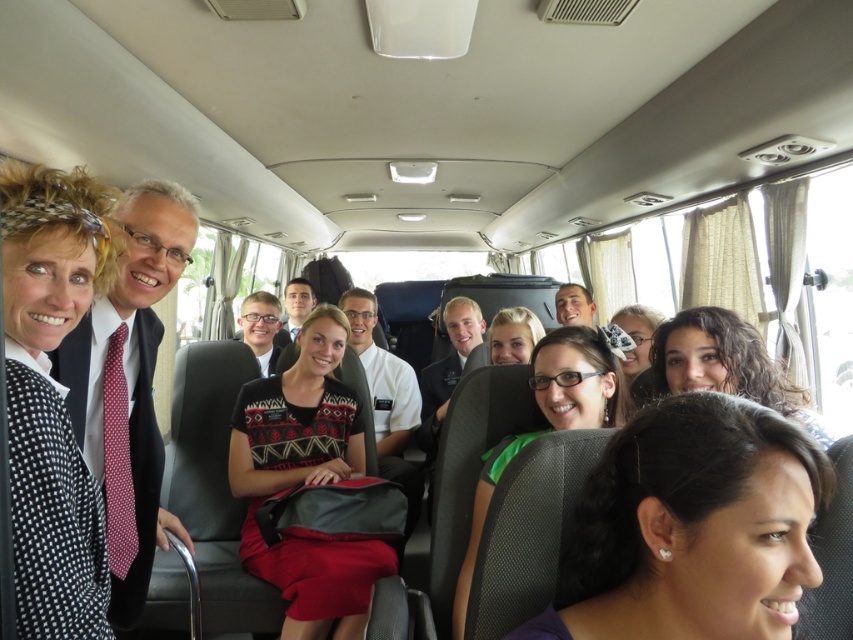
Can you confirm if knit sweater at center is positioned to the right of matte black suit at center?

Indeed, knit sweater at center is positioned on the right side of matte black suit at center.

Is point (294, 456) in front of point (273, 352)?

Yes, it is.

Is point (370, 570) farther from camera compared to point (276, 356)?

That is False.

Image resolution: width=853 pixels, height=640 pixels. Identify the location of knit sweater at center. (306, 483).

Can you confirm if matte black hair at center is shorter than curly brown hair at center?

In fact, matte black hair at center may be taller than curly brown hair at center.

Does matte black hair at center appear on the right side of curly brown hair at center?

No, matte black hair at center is not to the right of curly brown hair at center.

Locate an element on the screen. Image resolution: width=853 pixels, height=640 pixels. matte black hair at center is located at coordinates (691, 525).

Does point (567, 296) come in front of point (289, 320)?

Yes.

Can you confirm if matte white shirt at center is shorter than smooth white shirt at center?

Indeed, matte white shirt at center has a lesser height compared to smooth white shirt at center.

This screenshot has width=853, height=640. In order to click on matte white shirt at center in this screenshot , I will do `click(573, 305)`.